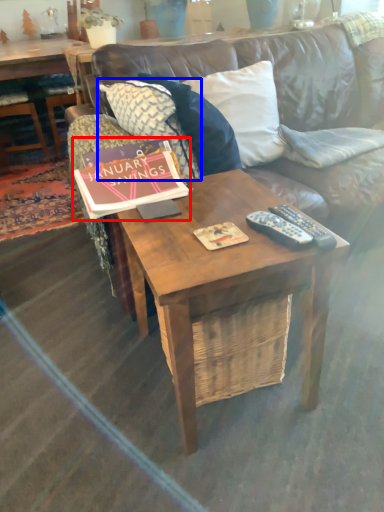
Question: Which object is further to the camera taking this photo, book (highlighted by a red box) or pillow (highlighted by a blue box)?

Choices:
 (A) book
 (B) pillow

Answer: (B)